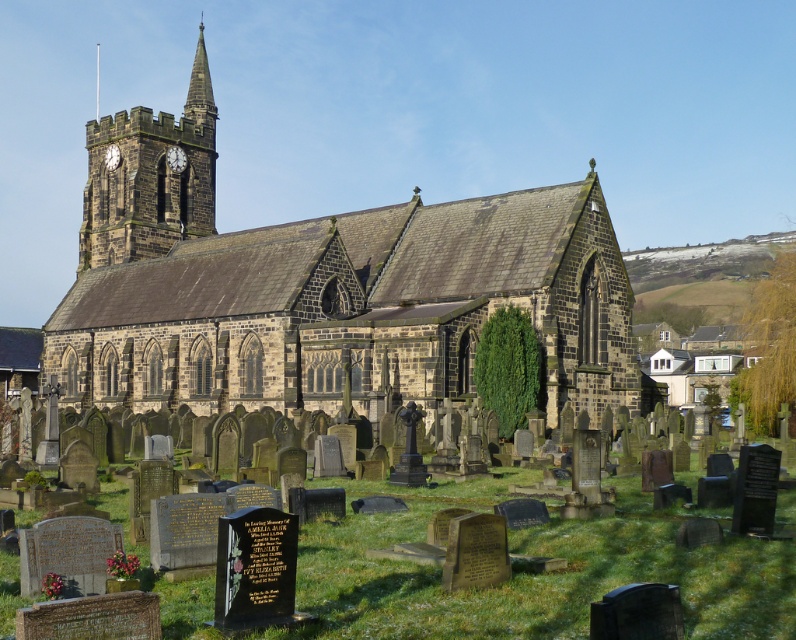
You are standing in front of the historic stone church and want to place a new flower arrangement. The flower arrangement needs to be placed to the left of the smooth stone spire at upper center. Can you place it among the gravestones at center?

The gravestones at center is positioned on the right side of smooth stone spire at upper center, so placing the flower arrangement to the left of the smooth stone spire at upper center would require placing it to the left of the gravestones at center, which may not be possible as the gravestones are already at the center. Check the available space to the left of the spire.

You are standing at the entrance of the historic stone church and want to place a new gravestone in the same area as the existing gravestones at center. According to the layout, where should you position the new gravestone?

The gravestones at center are located at point 2D coordinates (531, 577), so you should position the new gravestone near those coordinates to maintain consistency with the existing layout.